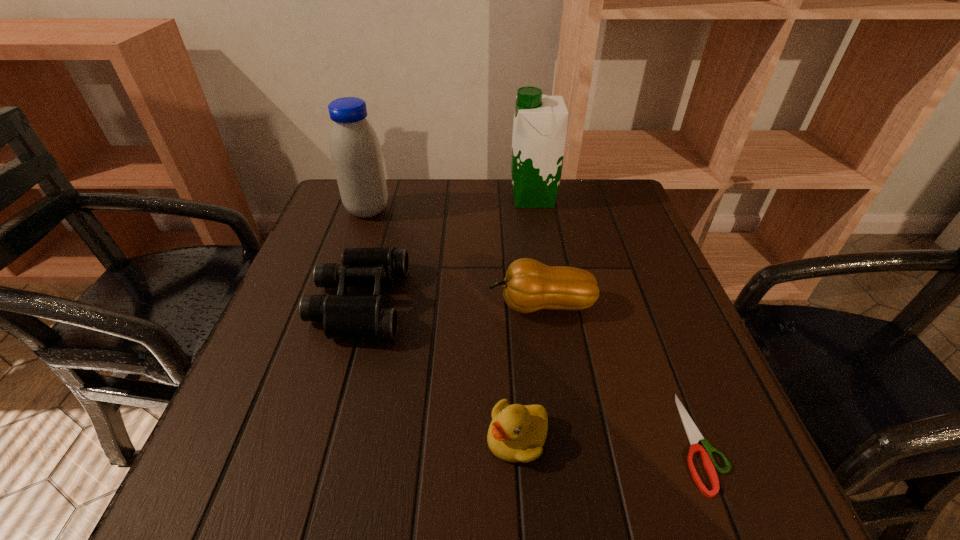
Identify the location of free space located 0.070m on the back of the left soya milk. The height and width of the screenshot is (540, 960). (376, 185).

The image size is (960, 540). Find the location of `vacant space located 0.300m on the stem side of the fourth shortest object`. vacant space located 0.300m on the stem side of the fourth shortest object is located at coordinates (342, 305).

Where is `blank space located 0.380m on the stem side of the fourth shortest object`? This screenshot has width=960, height=540. blank space located 0.380m on the stem side of the fourth shortest object is located at coordinates (302, 305).

Identify the location of vacant region located on the stem side of the fourth shortest object. (312, 305).

Where is `free spot located on the front-facing side of the binoculars`? The width and height of the screenshot is (960, 540). free spot located on the front-facing side of the binoculars is located at coordinates (599, 302).

Identify the location of vacant position located 0.050m on the beak of the duckling. (455, 437).

You are a GUI agent. You are given a task and a screenshot of the screen. Output one action in this format:
    pyautogui.click(x=<x>, y=<y>)
    Task: Click on the free region located 0.340m on the beak of the duckling
    The height and width of the screenshot is (540, 960).
    Given the screenshot: What is the action you would take?
    pyautogui.click(x=268, y=437)

You are a GUI agent. You are given a task and a screenshot of the screen. Output one action in this format:
    pyautogui.click(x=<x>, y=<y>)
    Task: Click on the vacant space located 0.290m on the beak of the duckling
    The height and width of the screenshot is (540, 960).
    Given the screenshot: What is the action you would take?
    pyautogui.click(x=300, y=437)

Find the location of a particular element. This screenshot has height=540, width=960. vacant space located on the back of the rightmost object is located at coordinates (661, 343).

The height and width of the screenshot is (540, 960). What are the coordinates of `duckling present at the near edge` in the screenshot? It's located at [517, 433].